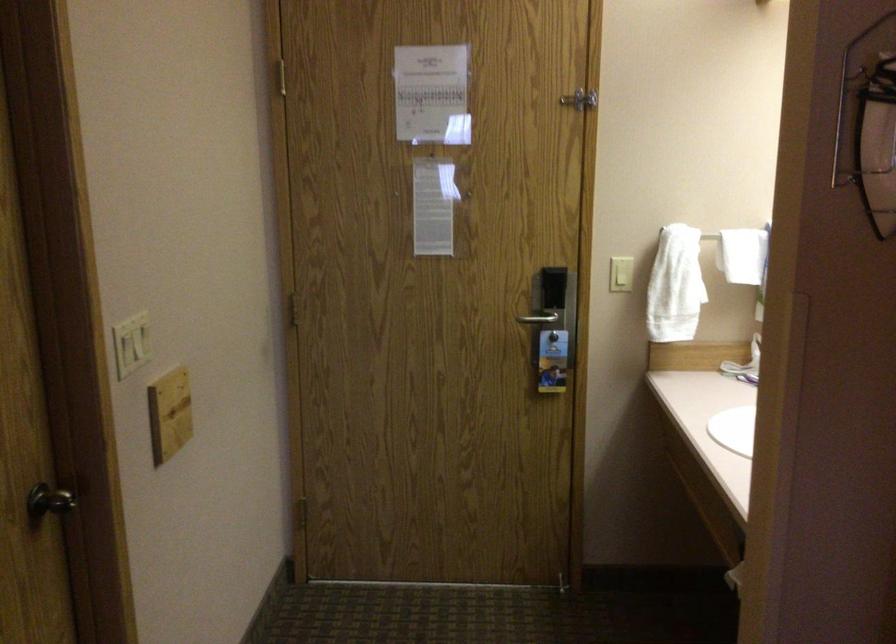
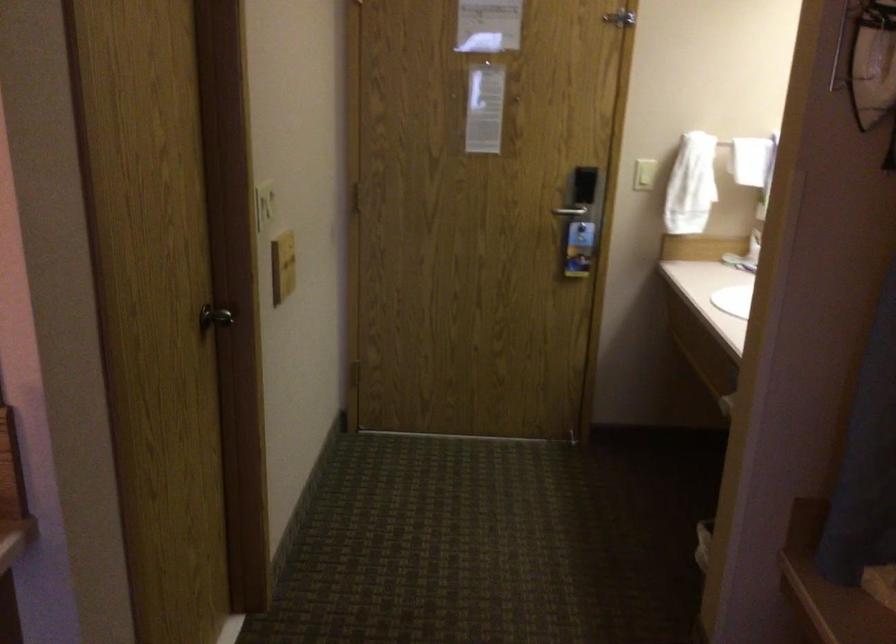
What movement of the cameraman would produce the second image?

The cameraman walked toward left, backward.